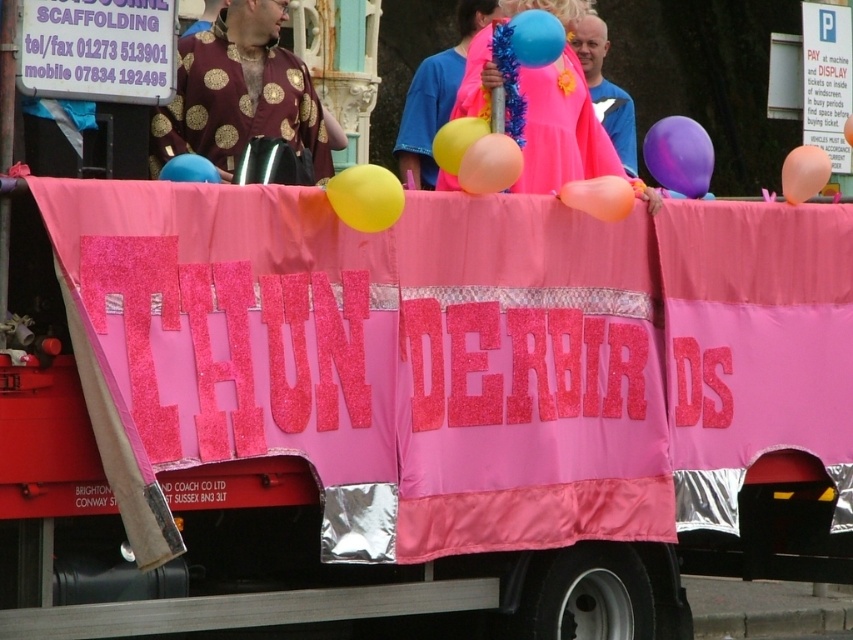
You are organizing a Thunderbirds themed event and need to arrange decorations. You have a maroon velvet robe at upper center and a pink rubber balloon at upper center. Which decoration takes up more space?

The pink rubber balloon at upper center takes up more space than the maroon velvet robe at upper center because the maroon velvet robe at upper center occupies less space.

You are at the parade and want to take a photo of both the pink fabric banner at center and the rubber balloon at center. Which object should you focus on first to ensure both are in the frame?

The pink fabric banner at center is positioned under the rubber balloon at center. To capture both in the frame, focus on the rubber balloon at center first as it is higher up, then adjust to include the banner below it.

You are a photographer standing at the back of the crowd. You want to take a photo that includes both the maroon velvet robe at upper center and the neon pink fabric at upper center. Given that your camera has a maximum focus range of 10 feet, will you be able to capture both subjects in focus?

The maroon velvet robe at upper center is 9.65 feet from the neon pink fabric at upper center. Since the distance between them is within the camera maximum focus range of 10 feet, you can capture both subjects in focus.